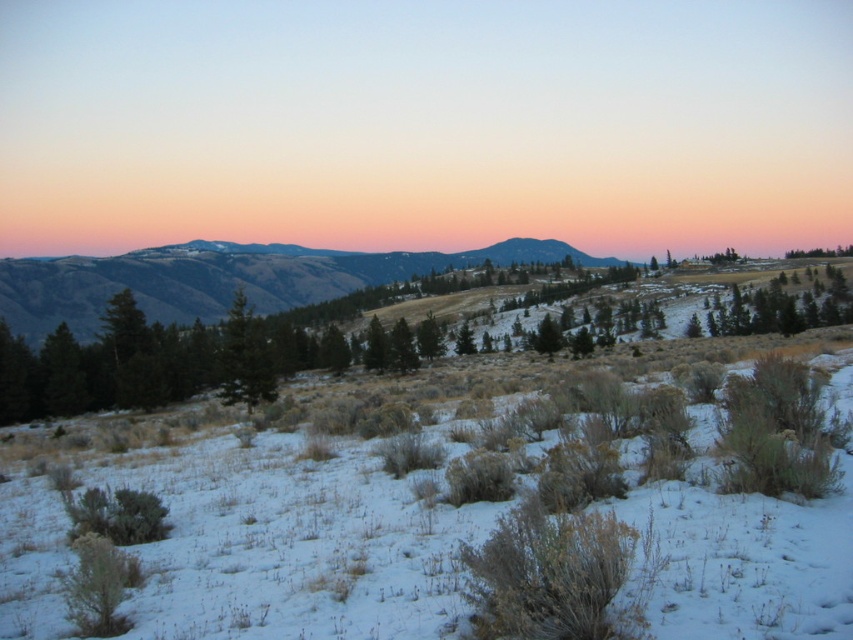
Can you confirm if green grassy hillside at center is bigger than green matte tree at right?

Yes.

Between point (286, 308) and point (734, 332), which one is positioned in front?

Point (734, 332)

Where is `green grassy hillside at center`? The image size is (853, 640). green grassy hillside at center is located at coordinates (228, 278).

Which is above, green grassy hillside at center or green matte tree at center?

Positioned higher is green grassy hillside at center.

Is green grassy hillside at center positioned before green matte tree at center?

No, green grassy hillside at center is further to the viewer.

The image size is (853, 640). I want to click on green grassy hillside at center, so click(228, 278).

Which is below, green matte tree at right or green matte tree at center?

green matte tree at center is below.

Measure the distance from green matte tree at right to green matte tree at center.

They are 88.54 meters apart.

Which is behind, point (811, 298) or point (234, 317)?

Point (811, 298)

In order to click on green matte tree at right in this screenshot , I will do `click(782, 305)`.